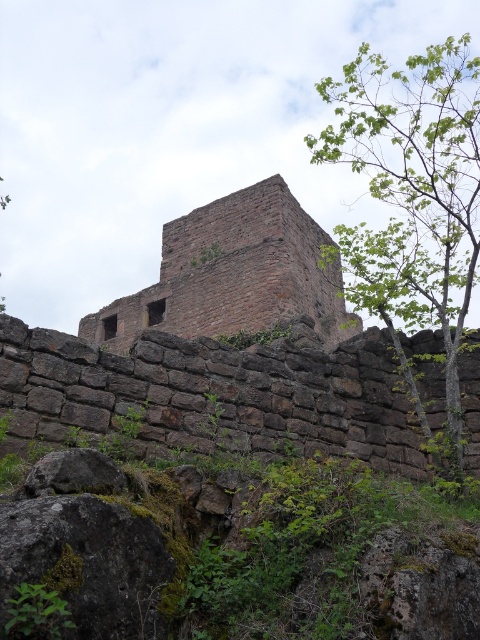
Does brown stone wall at center appear over brown stone tower at center?

No, brown stone wall at center is not above brown stone tower at center.

Who is lower down, brown stone wall at center or brown stone tower at center?

brown stone wall at center is below.

The image size is (480, 640). Identify the location of brown stone wall at center. (212, 396).

The image size is (480, 640). What do you see at coordinates (212, 396) in the screenshot?
I see `brown stone wall at center` at bounding box center [212, 396].

Is point (189, 397) more distant than point (462, 64)?

No, it is in front of (462, 64).

Where is `brown stone wall at center`? The image size is (480, 640). brown stone wall at center is located at coordinates (212, 396).

Is green leafy tree at upper right smaller than brown stone tower at center?

No, green leafy tree at upper right is not smaller than brown stone tower at center.

This screenshot has width=480, height=640. I want to click on green leafy tree at upper right, so click(412, 202).

Is point (437, 44) positioned after point (143, 291)?

Yes.

You are a GUI agent. You are given a task and a screenshot of the screen. Output one action in this format:
    pyautogui.click(x=<x>, y=<y>)
    Task: Click on the green leafy tree at upper right
    The width and height of the screenshot is (480, 640).
    Given the screenshot: What is the action you would take?
    pos(412,202)